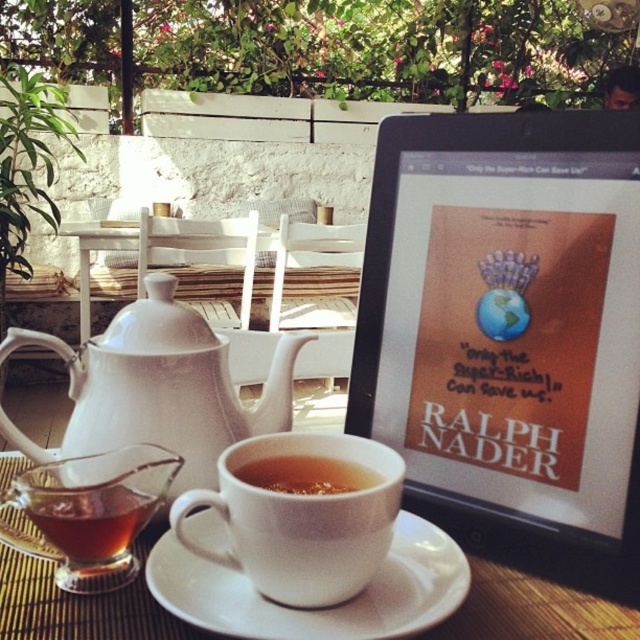
Question: Is white glossy teapot at center-left thinner than white ceramic cup at center?

Choices:
 (A) no
 (B) yes

Answer: (A)

Question: Which point is closer to the camera?

Choices:
 (A) (237, 465)
 (B) (81, 428)
 (C) (252, 625)
 (D) (124, 506)

Answer: (C)

Question: Which of the following is the closest to the observer?

Choices:
 (A) transparent glass teacup at lower left
 (B) translucent glass cup at lower left

Answer: (A)

Question: Which of the following is the closest to the observer?

Choices:
 (A) translucent glass cup at center
 (B) translucent glass cup at lower left

Answer: (B)

Question: Is white ceramic saucer at center bigger than transparent glass teacup at lower left?

Choices:
 (A) yes
 (B) no

Answer: (A)

Question: Is white glossy teapot at center-left thinner than translucent glass cup at lower left?

Choices:
 (A) no
 (B) yes

Answer: (A)